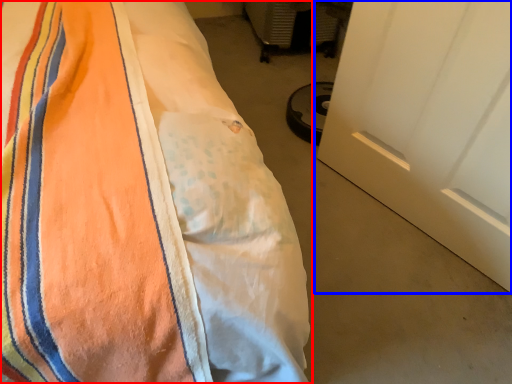
Question: Which of the following is the farthest to the observer, bed (highlighted by a red box) or door (highlighted by a blue box)?

Choices:
 (A) bed
 (B) door

Answer: (B)